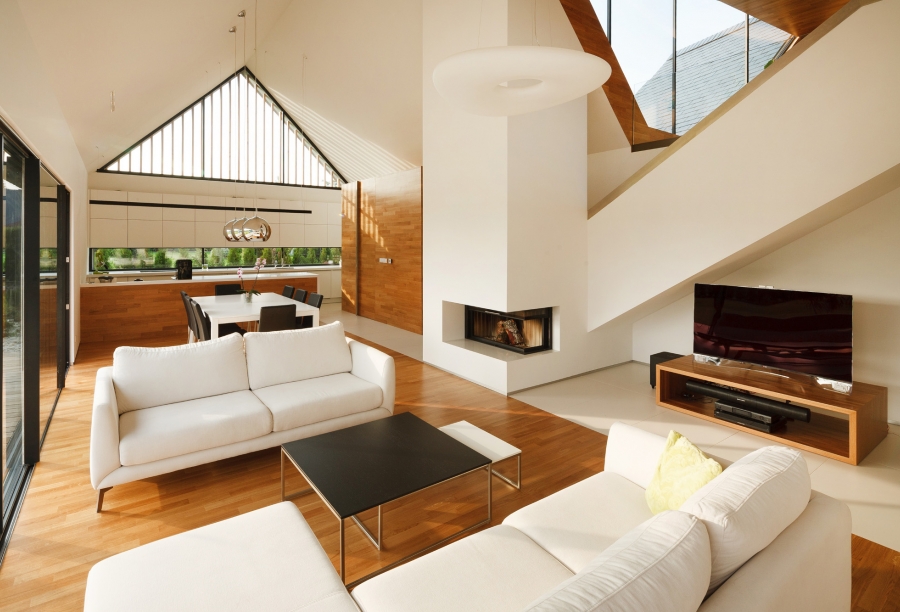
Find the location of a particular element. This screenshot has width=900, height=612. side door is located at coordinates (15, 409), (59, 348).